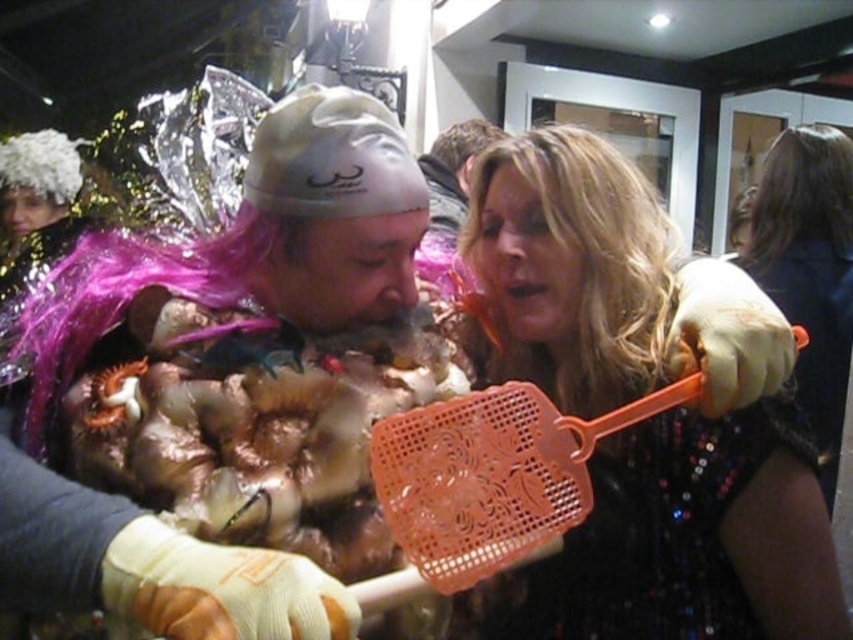
Question: Is orange plastic fly swatter at upper right positioned at the back of shiny black dress at center?

Choices:
 (A) yes
 (B) no

Answer: (B)

Question: Which object is positioned closest to the shiny black dress at center?

Choices:
 (A) frothy brown foam at center
 (B) shiny metallic costume at center
 (C) blonde hair at upper center
 (D) pink shiny wig at upper center

Answer: (D)

Question: Which is nearer to the shiny black dress at center?

Choices:
 (A) brown synthetic wig at upper right
 (B) orange plastic flyswatter at upper right
 (C) smooth brown leather jacket at upper center

Answer: (A)

Question: Which of these objects is positioned farthest from the frothy brown foam at center?

Choices:
 (A) pink shiny wig at upper center
 (B) brown synthetic wig at upper right

Answer: (A)

Question: Is shiny metallic costume at center thinner than orange plastic flyswatter at upper right?

Choices:
 (A) yes
 (B) no

Answer: (B)

Question: Does shiny metallic costume at center have a greater width compared to frothy brown foam at center?

Choices:
 (A) no
 (B) yes

Answer: (B)